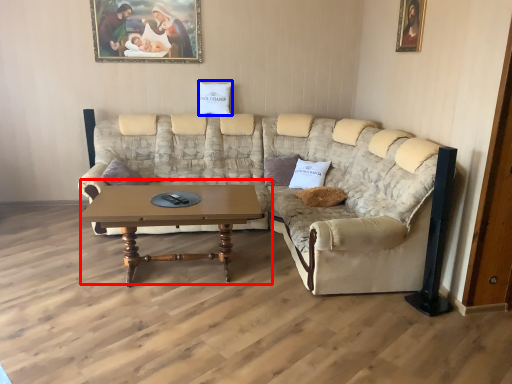
Question: Among these objects, which one is nearest to the camera, coffee table (highlighted by a red box) or pillow (highlighted by a blue box)?

Choices:
 (A) coffee table
 (B) pillow

Answer: (A)